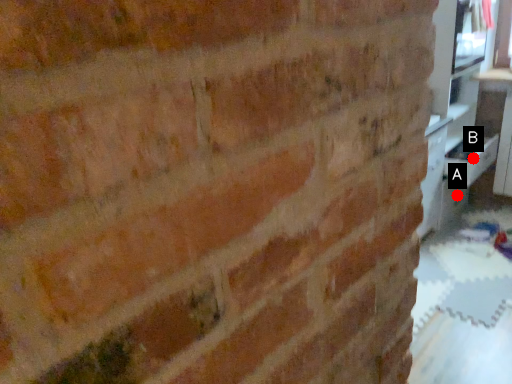
Question: Two points are circled on the image, labeled by A and B beside each circle. Which point is closer to the camera?

Choices:
 (A) A is closer
 (B) B is closer

Answer: (B)